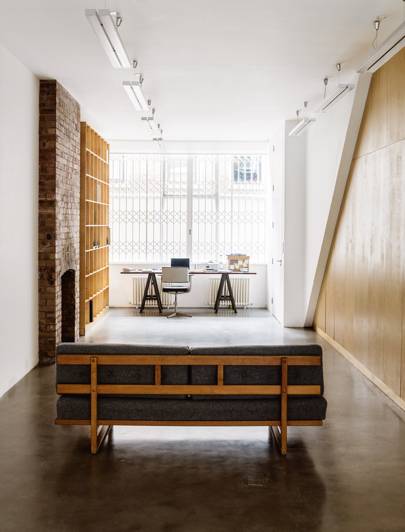
Find the location of `tall brown wooden shelves`. tall brown wooden shelves is located at coordinates (101, 211).